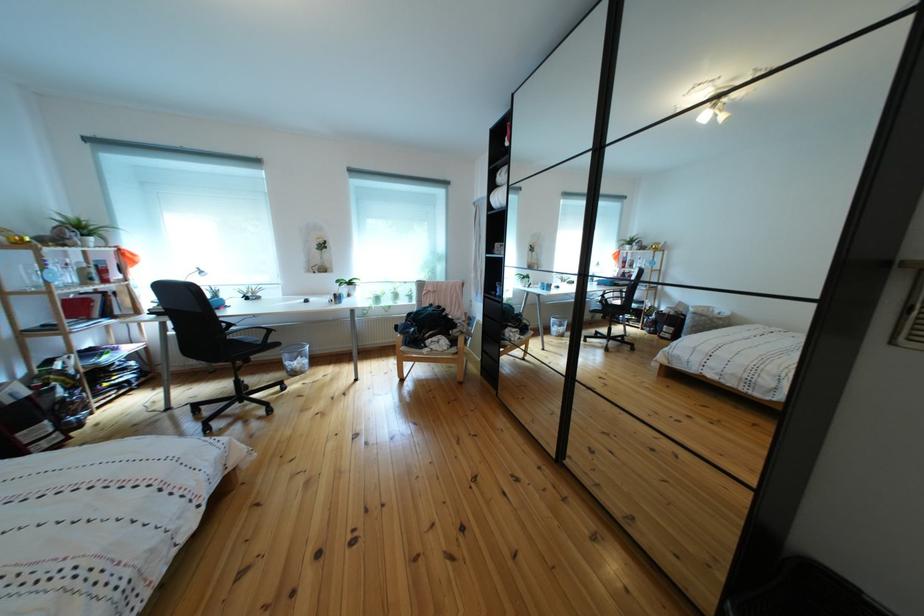
Where would you lift the mesh trash can? Please return your answer as a coordinate pair (x, y).

(295, 358)